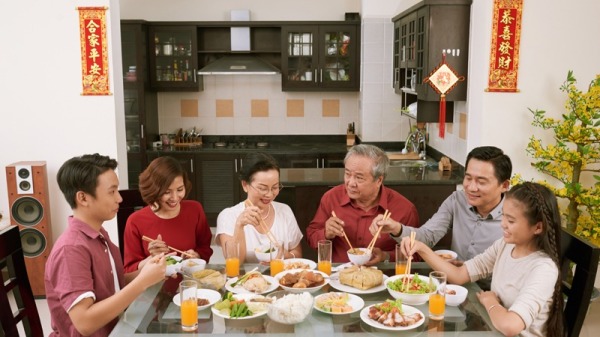
The image size is (600, 337). Identify the location of knife block. (348, 136).